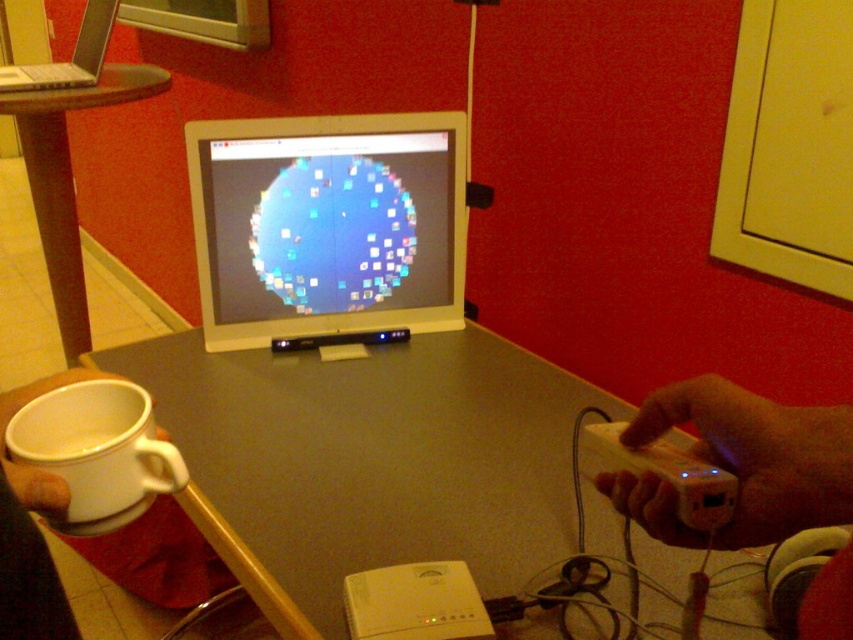
Question: Is brown wooden table at left above silver metallic laptop at upper left?

Choices:
 (A) no
 (B) yes

Answer: (A)

Question: Can you confirm if smooth gray table at center is positioned to the right of white glossy computer monitor at center?

Choices:
 (A) no
 (B) yes

Answer: (B)

Question: Can you confirm if wooden remote control at lower right is positioned below brown wooden table at left?

Choices:
 (A) yes
 (B) no

Answer: (A)

Question: Which object appears farthest from the camera in this image?

Choices:
 (A) smooth gray table at center
 (B) wooden remote control at lower right
 (C) brown wooden table at left
 (D) white plastic game controller at lower right

Answer: (C)

Question: Which object appears farthest from the camera in this image?

Choices:
 (A) white plastic game controller at lower right
 (B) white glossy computer monitor at center
 (C) silver metallic laptop at upper left

Answer: (C)

Question: Which of the following is the closest to the observer?

Choices:
 (A) (801, 490)
 (B) (292, 124)
 (C) (695, 492)
 (D) (99, 84)

Answer: (A)